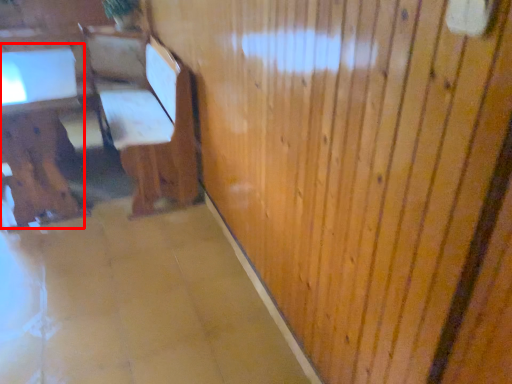
Question: Where is table (annotated by the red box) located in relation to furniture in the image?

Choices:
 (A) left
 (B) right

Answer: (A)